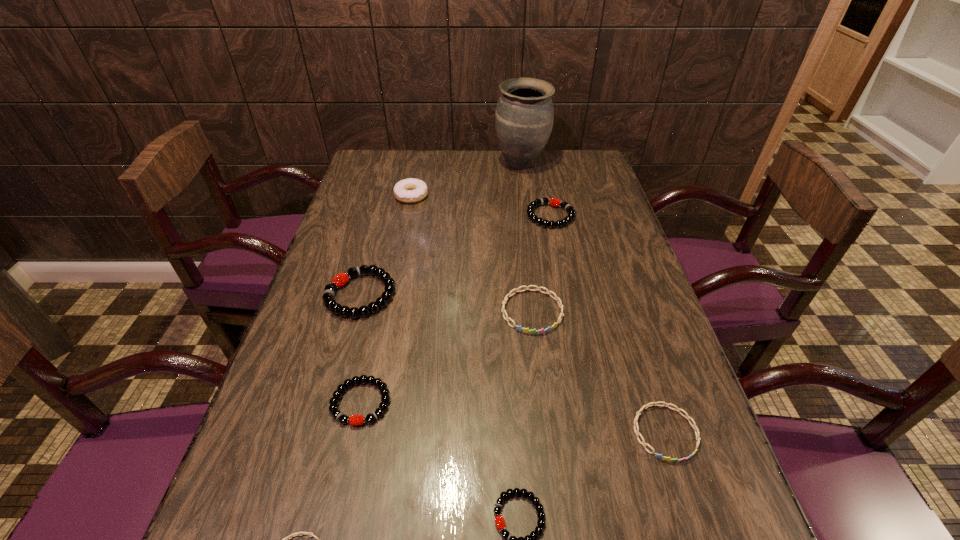
This screenshot has width=960, height=540. What are the coordinates of `the tallest object` in the screenshot? It's located at (524, 117).

You are a GUI agent. You are given a task and a screenshot of the screen. Output one action in this format:
    pyautogui.click(x=<x>, y=<y>)
    Task: Click on the urn
    This screenshot has width=960, height=540.
    Given the screenshot: What is the action you would take?
    pyautogui.click(x=524, y=117)

The height and width of the screenshot is (540, 960). Identify the location of white doughnut. (411, 190).

At what (x,y) coordinates should I click in order to perform the action: click on doughnut. Please return your answer as a coordinate pair (x, y). Looking at the image, I should click on (411, 190).

You are a GUI agent. You are given a task and a screenshot of the screen. Output one action in this format:
    pyautogui.click(x=<x>, y=<y>)
    Task: Click on the tallest bracelet
    This screenshot has width=960, height=540.
    Given the screenshot: What is the action you would take?
    pyautogui.click(x=341, y=279)

Identify the location of the third nearest black bracelet. (341, 279).

Where is `the farthest black bracelet`? the farthest black bracelet is located at coordinates (554, 202).

Find the location of a particular element. the second biggest black bracelet is located at coordinates (554, 202).

Find the location of a particular element. This screenshot has width=960, height=540. the farthest blue bracelet is located at coordinates (534, 331).

You are a GUI agent. You are given a task and a screenshot of the screen. Output one action in this format:
    pyautogui.click(x=<x>, y=<y>)
    Task: Click on the biggest blue bracelet
    The width and height of the screenshot is (960, 540).
    Given the screenshot: What is the action you would take?
    pyautogui.click(x=534, y=331)